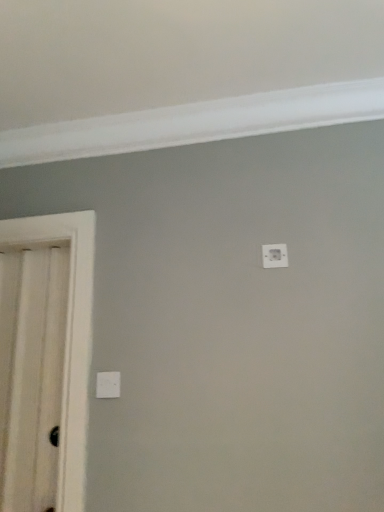
Question: Looking at the image, does white glossy door at left seem bigger or smaller compared to white plastic light switch at lower center, marked as the 1th light switch in a bottom-to-top arrangement?

Choices:
 (A) big
 (B) small

Answer: (A)

Question: Which is correct: white glossy door at left is inside white plastic light switch at lower center, which ranks as the first light switch in left-to-right order, or outside of it?

Choices:
 (A) inside
 (B) outside

Answer: (B)

Question: Considering the real-world distances, which object is closest to the white plastic light switch at lower center, marked as the 1th light switch in a bottom-to-top arrangement?

Choices:
 (A) white glossy door at left
 (B) white plastic light switch at upper center, placed as the second light switch when sorted from left to right

Answer: (A)

Question: Which object is the closest to the white plastic light switch at upper center, the 1th light switch positioned from the top?

Choices:
 (A) white plastic light switch at lower center, which ranks as the first light switch in left-to-right order
 (B) white glossy door at left

Answer: (A)